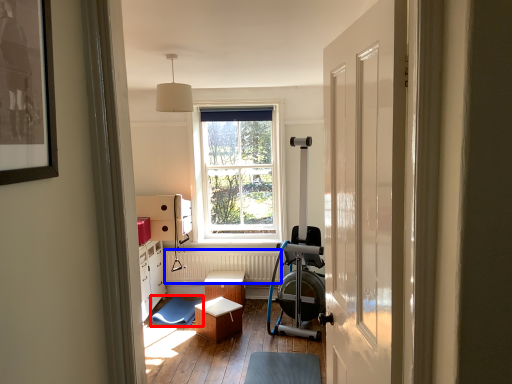
Question: Which object appears closest to the camera in this image, swivel chair (highlighted by a red box) or radiator (highlighted by a blue box)?

Choices:
 (A) swivel chair
 (B) radiator

Answer: (A)